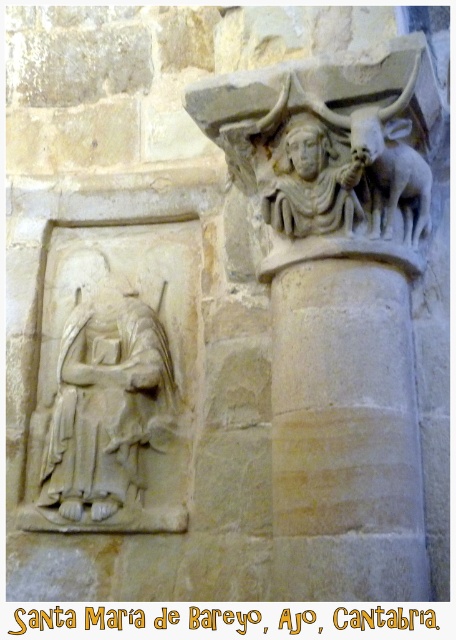
Between beige stone column at center and white stone carving at upper center, which one is positioned lower?

beige stone column at center is lower down.

Is point (285, 420) less distant than point (304, 150)?

No, (285, 420) is behind (304, 150).

Locate an element on the screen. Image resolution: width=456 pixels, height=640 pixels. beige stone column at center is located at coordinates (345, 435).

Is point (408, 380) farther from viewer compared to point (129, 284)?

No, it is in front of (129, 284).

Describe the element at coordinates (345, 435) in the screenshot. I see `beige stone column at center` at that location.

Locate an element on the screen. This screenshot has height=640, width=456. beige stone column at center is located at coordinates (345, 435).

Does white stone relief at left have a larger size compared to white stone carving at upper center?

Yes, white stone relief at left is bigger than white stone carving at upper center.

Does white stone relief at left have a lesser width compared to white stone carving at upper center?

No.

Locate an element on the screen. The image size is (456, 640). white stone relief at left is located at coordinates (105, 401).